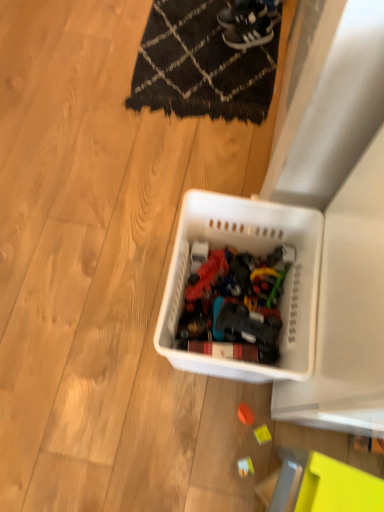
Where is `free space that is to the left of black suede sneakers at upper center, acting as the 1th footwear starting from the top`? This screenshot has width=384, height=512. free space that is to the left of black suede sneakers at upper center, acting as the 1th footwear starting from the top is located at coordinates (199, 17).